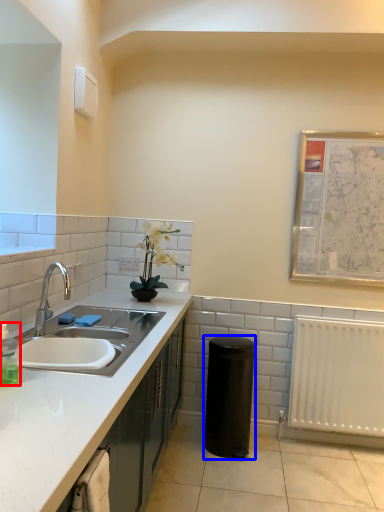
Question: Which object appears farthest to the camera in this image, bottle (highlighted by a red box) or appliance (highlighted by a blue box)?

Choices:
 (A) bottle
 (B) appliance

Answer: (B)